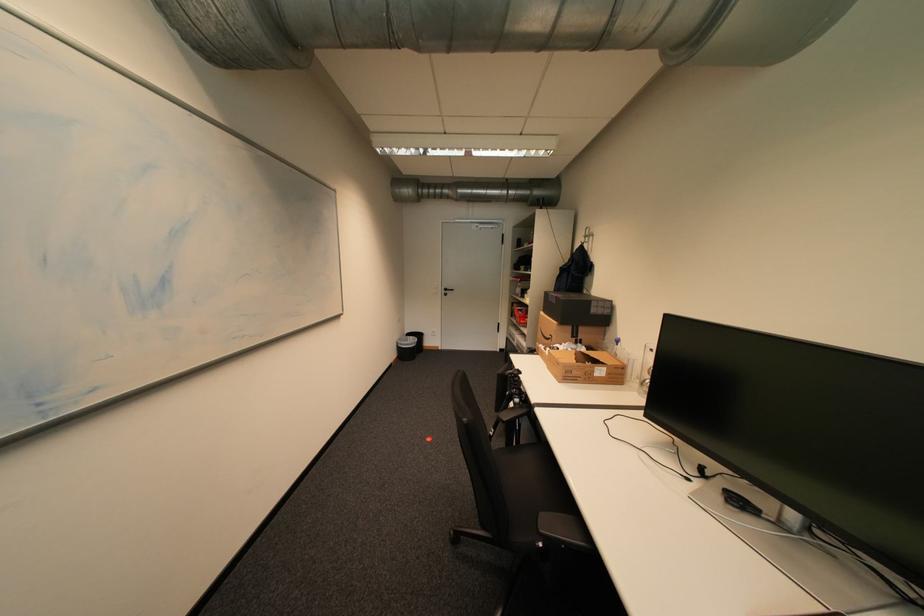
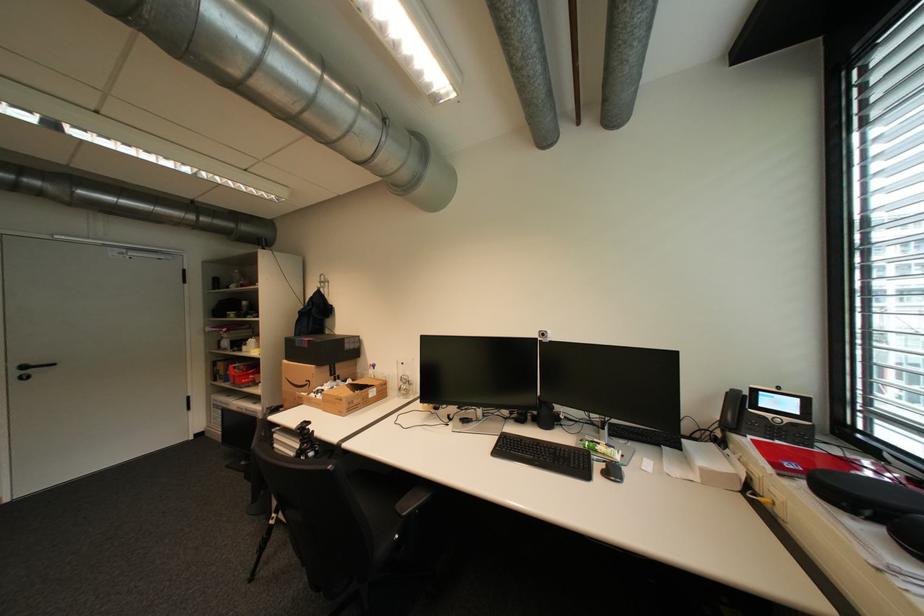
The point at (455, 290) is marked in the first image. Where is the corresponding point in the second image?

(32, 368)